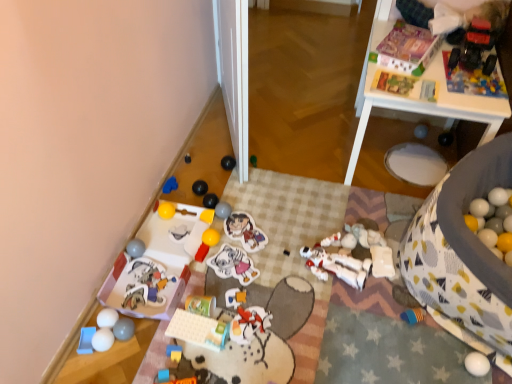
In order to click on free spot behind yellow matte ball at center, which appears as the thirteenth toy when viewed from the left in this screenshot , I will do `click(230, 193)`.